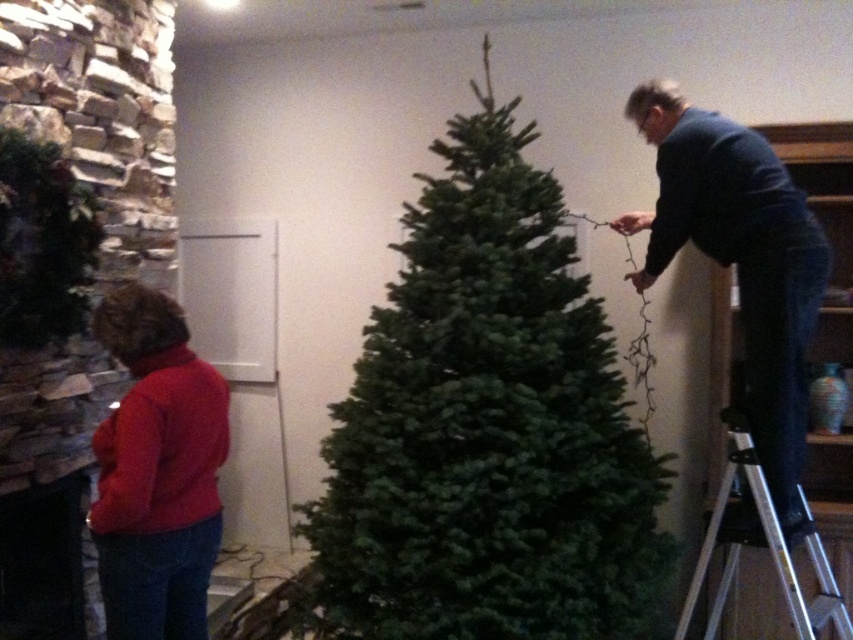
Question: Among these points, which one is nearest to the camera?

Choices:
 (A) (160, 621)
 (B) (809, 225)

Answer: (A)

Question: Can you confirm if green matte christmas tree at center is bigger than silver metallic ladder at right?

Choices:
 (A) no
 (B) yes

Answer: (B)

Question: Does green matte christmas tree at center have a smaller size compared to silver metallic ladder at right?

Choices:
 (A) no
 (B) yes

Answer: (A)

Question: Is green matte christmas tree at center to the right of dark blue suit at right from the viewer's perspective?

Choices:
 (A) yes
 (B) no

Answer: (B)

Question: Which object appears closest to the camera in this image?

Choices:
 (A) red matte sweater at lower left
 (B) dark blue suit at right
 (C) silver metallic ladder at right

Answer: (A)

Question: Among these objects, which one is farthest from the camera?

Choices:
 (A) red matte sweater at lower left
 (B) dark blue suit at right
 (C) green matte christmas tree at center
 (D) silver metallic ladder at right

Answer: (C)